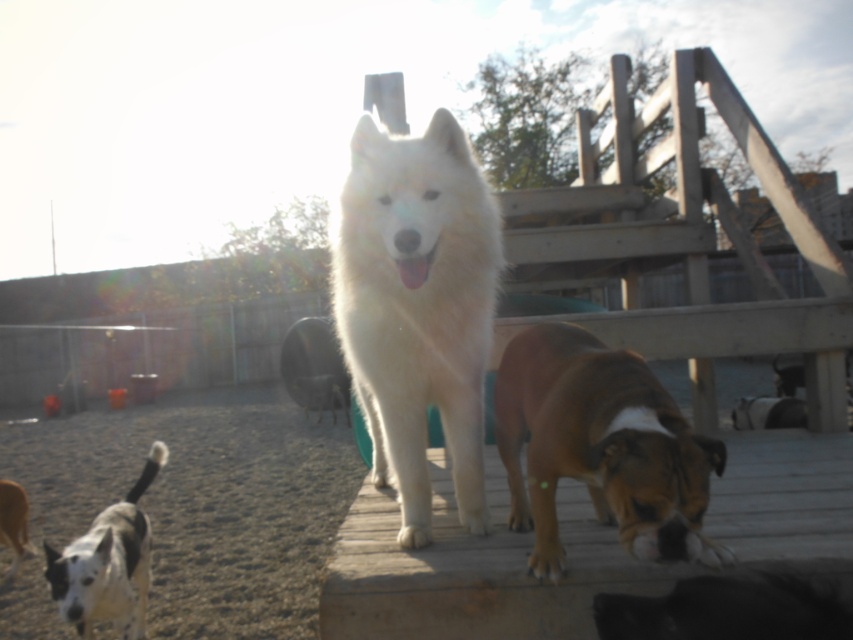
Between point (843, 518) and point (62, 580), which one is positioned in front?

Point (843, 518) is in front.

From the picture: Can you confirm if wooden deck at center is positioned to the right of spotted fur dog at lower left?

Indeed, wooden deck at center is positioned on the right side of spotted fur dog at lower left.

Locate an element on the screen. The height and width of the screenshot is (640, 853). wooden deck at center is located at coordinates [474, 570].

Does wooden deck at center appear on the left side of brown matte dog at center?

No, wooden deck at center is not to the left of brown matte dog at center.

Describe the element at coordinates (474, 570) in the screenshot. The width and height of the screenshot is (853, 640). I see `wooden deck at center` at that location.

Locate an element on the screen. wooden deck at center is located at coordinates (474, 570).

Find the location of a particular element. wooden deck at center is located at coordinates (474, 570).

Looking at this image, does wooden deck at center have a greater width compared to white fluffy dog at center?

Indeed, wooden deck at center has a greater width compared to white fluffy dog at center.

Does wooden deck at center lie behind white fluffy dog at center?

No.

Locate an element on the screen. The image size is (853, 640). wooden deck at center is located at coordinates (474, 570).

Identify the location of wooden deck at center. The image size is (853, 640). (474, 570).